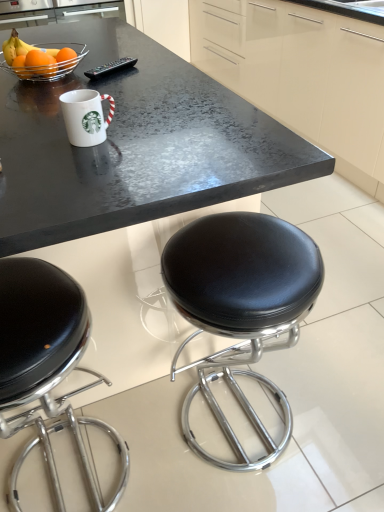
Where is `free location to the left of white glossy mug at upper center`? free location to the left of white glossy mug at upper center is located at coordinates (38, 135).